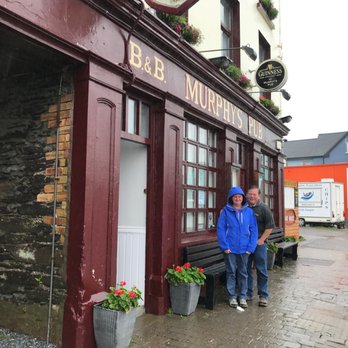
At what (x,y) coordinates should I click in order to perform the action: click on rightmost shoe. Please return your answer as a coordinate pair (x, y). The height and width of the screenshot is (348, 348). Looking at the image, I should click on (264, 302).